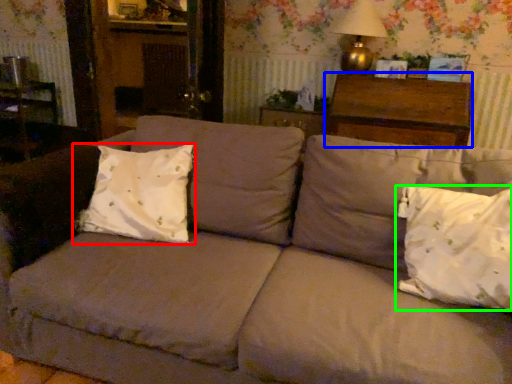
Question: Which is nearer to the pillow (highlighted by a red box)? hardwood (highlighted by a blue box) or pillow (highlighted by a green box).

Choices:
 (A) hardwood
 (B) pillow

Answer: (B)